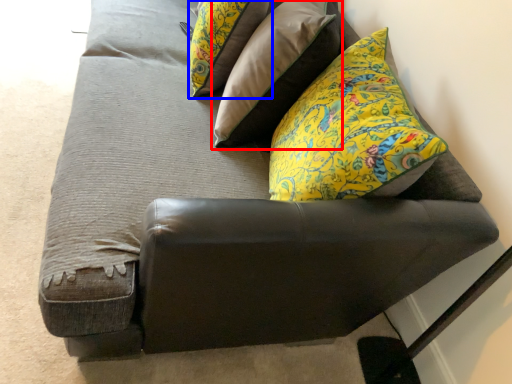
Question: Among these objects, which one is nearest to the camera, pillow (highlighted by a red box) or pillow (highlighted by a blue box)?

Choices:
 (A) pillow
 (B) pillow

Answer: (A)